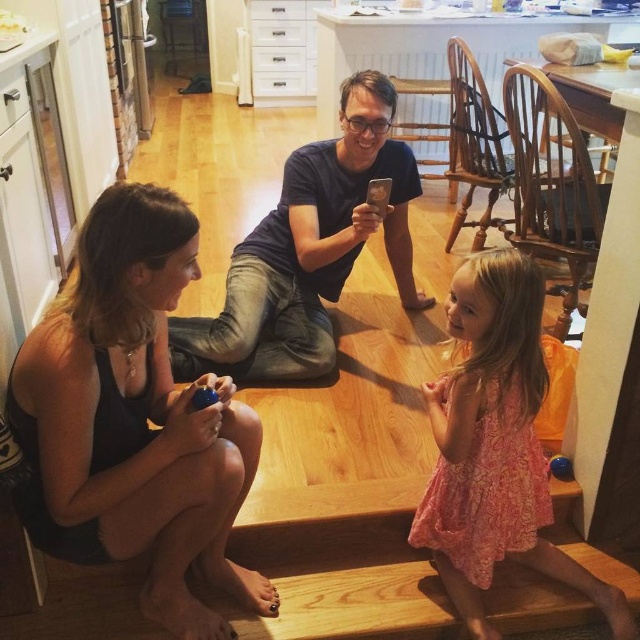
Question: Which object appears closest to the camera in this image?

Choices:
 (A) black matte tank top at lower left
 (B) pink lace dress at center
 (C) dark blue shirt at center

Answer: (A)

Question: Does black matte tank top at lower left have a smaller size compared to dark blue shirt at center?

Choices:
 (A) no
 (B) yes

Answer: (B)

Question: Can you confirm if black matte tank top at lower left is bigger than dark blue shirt at center?

Choices:
 (A) no
 (B) yes

Answer: (A)

Question: Can you confirm if black matte tank top at lower left is positioned to the right of dark blue shirt at center?

Choices:
 (A) yes
 (B) no

Answer: (B)

Question: Based on their relative distances, which object is farther from the black matte tank top at lower left?

Choices:
 (A) dark blue shirt at center
 (B) pink lace dress at center

Answer: (A)

Question: Which point appears closest to the camera in this image?

Choices:
 (A) (388, 214)
 (B) (465, 600)
 (C) (193, 630)

Answer: (C)